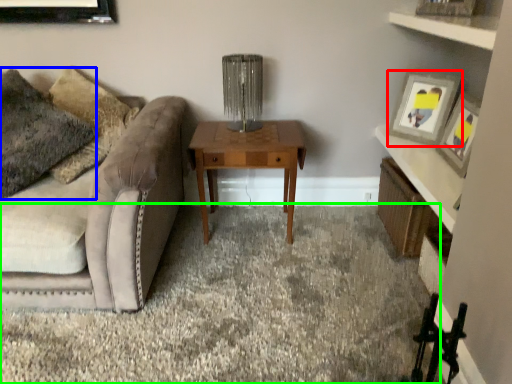
Question: Considering the real-world distances, which object is farthest from picture frame (highlighted by a red box)? pillow (highlighted by a blue box) or plain (highlighted by a green box)?

Choices:
 (A) pillow
 (B) plain

Answer: (A)